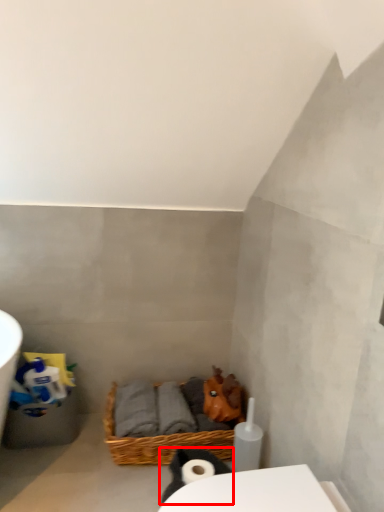
Question: From the image's perspective, considering the relative positions of animal (annotated by the red box) and basket in the image provided, where is animal (annotated by the red box) located with respect to the staircase?

Choices:
 (A) above
 (B) below

Answer: (B)